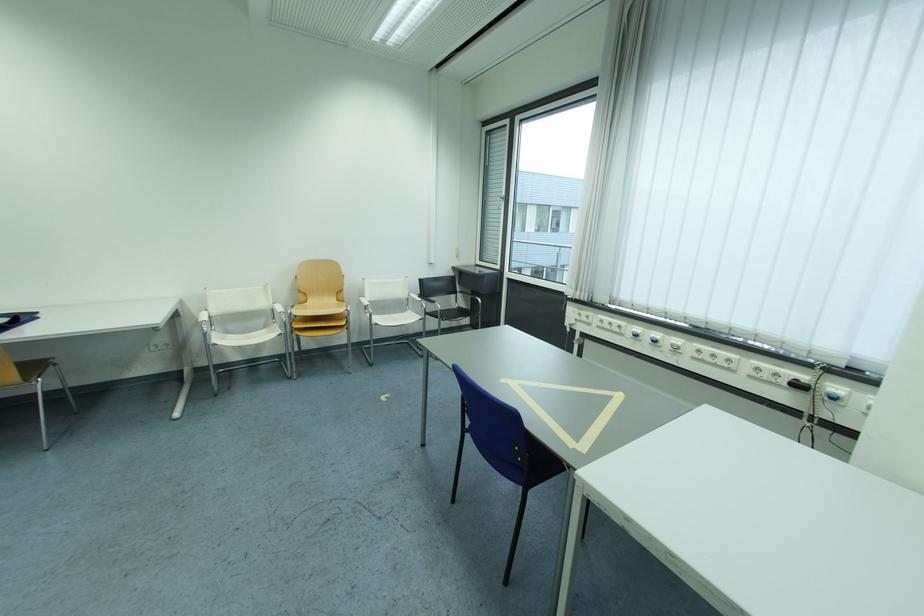
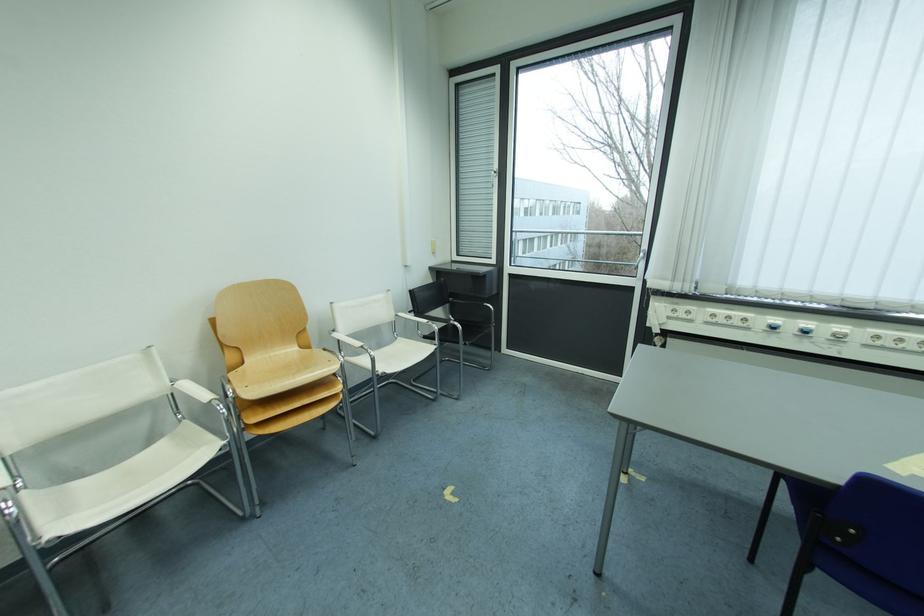
The point at [619,326] is marked in the first image. Where is the corresponding point in the second image?

(737, 320)